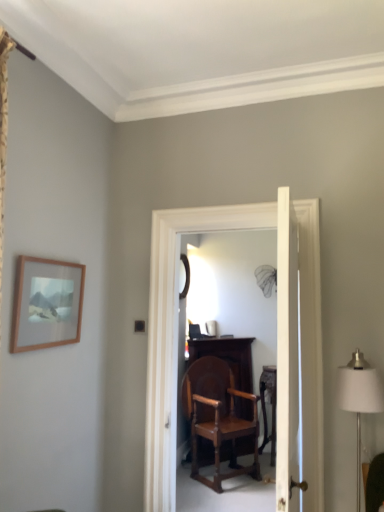
What is the approximate width of wooden frame at upper left?

The width of wooden frame at upper left is 2.13 inches.

The width and height of the screenshot is (384, 512). Describe the element at coordinates (184, 276) in the screenshot. I see `black glass mirror at center` at that location.

Locate an element on the screen. wooden frame at upper left is located at coordinates [47, 304].

Could you tell me if black glass mirror at center is facing wooden table at center?

No.

Which of these two, black glass mirror at center or wooden table at center, is smaller?

black glass mirror at center is smaller.

Are black glass mirror at center and wooden table at center beside each other?

There is a gap between black glass mirror at center and wooden table at center.

Is the position of wooden frame at upper left more distant than that of white smooth door at center?

Yes, it is.

Between wooden frame at upper left and white smooth door at center, which one has larger size?

With larger size is white smooth door at center.

In the scene shown: Which object is thinner, wooden frame at upper left or white smooth door at center?

With smaller width is wooden frame at upper left.

Can you confirm if wooden frame at upper left is positioned to the left of white smooth door at center?

Yes.

Considering the positions of points (352, 354) and (21, 256), is point (352, 354) farther from camera compared to point (21, 256)?

That is True.

Does white fabric lampshade at right turn towards wooden frame at upper left?

No.

Who is taller, white fabric lampshade at right or wooden frame at upper left?

Standing taller between the two is white fabric lampshade at right.

Is wooden chair at center shorter than wooden frame at upper left?

No, wooden chair at center is not shorter than wooden frame at upper left.

Is wooden chair at center placed right next to wooden frame at upper left?

No, wooden chair at center is not next to wooden frame at upper left.

Which object is positioned more to the right, wooden chair at center or wooden frame at upper left?

wooden chair at center is more to the right.

Which object is closer to the camera, wooden chair at center or wooden frame at upper left?

wooden frame at upper left is in front.

Does wooden chair at center turn towards wooden table at center?

No, wooden chair at center is not oriented towards wooden table at center.

Is wooden chair at center next to wooden table at center?

No, wooden chair at center is not beside wooden table at center.

Is wooden chair at center taller than wooden table at center?

Correct, wooden chair at center is much taller as wooden table at center.

Considering the sizes of objects white smooth door at center and wooden frame at upper left in the image provided, who is taller, white smooth door at center or wooden frame at upper left?

white smooth door at center.

Locate an element on the screen. picture frame located above the white smooth door at center (from a real-world perspective) is located at coordinates click(x=47, y=304).

Is white smooth door at center oriented towards wooden frame at upper left?

Yes, white smooth door at center is oriented towards wooden frame at upper left.

Which point is more distant from viewer, (297,234) or (54,333)?

The point (297,234) is farther from the camera.

Is white smooth door at center aimed at wooden table at center?

No.

Is white smooth door at center far from wooden table at center?

Yes, white smooth door at center is far from wooden table at center.

Is white smooth door at center bigger than wooden table at center?

Correct, white smooth door at center is larger in size than wooden table at center.

From the image's perspective, is white smooth door at center on top of wooden table at center?

Yes.

You are a GUI agent. You are given a task and a screenshot of the screen. Output one action in this format:
    pyautogui.click(x=<x>, y=<y>)
    Task: Click on the mirror located above the wooden table at center (from the image's perspective)
    This screenshot has width=384, height=512.
    Given the screenshot: What is the action you would take?
    pyautogui.click(x=184, y=276)

Find the location of `door in front of the wooden frame at upper left`. door in front of the wooden frame at upper left is located at coordinates (288, 359).

Estimate the real-world distances between objects in this image. Which object is further from white fabric lampshade at right, wooden table at center or black glass mirror at center?

Among the two, black glass mirror at center is located further to white fabric lampshade at right.

In the scene shown: When comparing their distances from wooden frame at upper left, does wooden table at center or wooden chair at center seem closer?

wooden chair at center.

Based on their spatial positions, is white fabric lampshade at right or white smooth door at center closer to wooden frame at upper left?

Based on the image, white smooth door at center appears to be nearer to wooden frame at upper left.

From the image, which object appears to be nearer to wooden frame at upper left, wooden chair at center or black glass mirror at center?

Based on the image, wooden chair at center appears to be nearer to wooden frame at upper left.

Considering their positions, is wooden frame at upper left positioned closer to white fabric lampshade at right than wooden table at center?

Based on the image, wooden frame at upper left appears to be nearer to white fabric lampshade at right.

Considering their positions, is wooden frame at upper left positioned further to wooden table at center than white smooth door at center?

Among the two, wooden frame at upper left is located further to wooden table at center.

From the image, which object appears to be nearer to white smooth door at center, wooden table at center or wooden frame at upper left?

wooden frame at upper left lies closer to white smooth door at center than the other object.

Estimate the real-world distances between objects in this image. Which object is closer to white smooth door at center, white fabric lampshade at right or wooden chair at center?

white fabric lampshade at right is closer to white smooth door at center.

Locate an element on the screen. chair between white fabric lampshade at right and wooden table at center in the front-back direction is located at coordinates (219, 420).

Where is `table between white fabric lampshade at right and black glass mirror at center in the front-back direction`? table between white fabric lampshade at right and black glass mirror at center in the front-back direction is located at coordinates (272, 407).

Locate an element on the screen. The width and height of the screenshot is (384, 512). table lamp between white smooth door at center and wooden chair at center along the z-axis is located at coordinates (359, 396).

Find the location of a particular element. The width and height of the screenshot is (384, 512). table between wooden frame at upper left and black glass mirror at center from front to back is located at coordinates (272, 407).